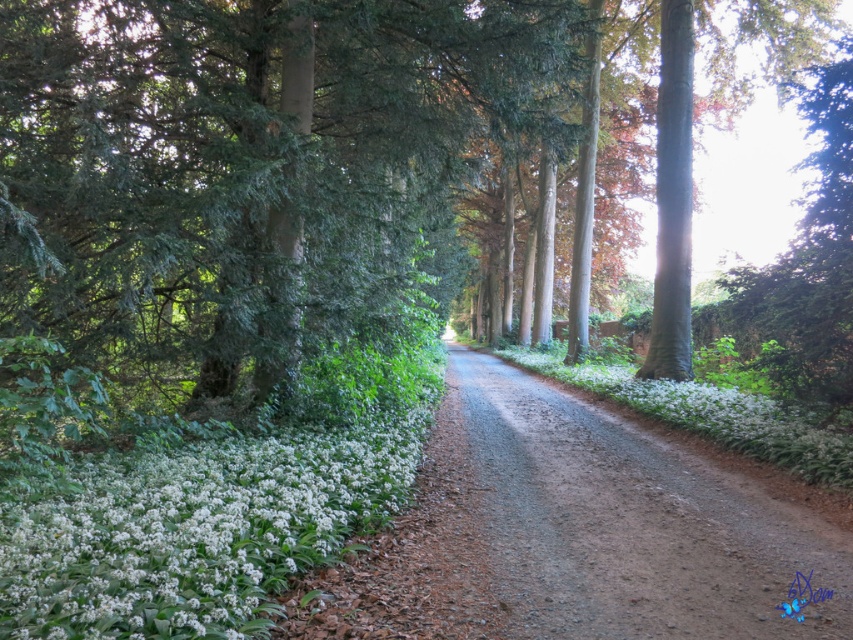
Which of these two, green textured tree at center or white matte flowers at lower left, stands shorter?

white matte flowers at lower left is shorter.

Is green textured tree at center positioned in front of white matte flowers at lower left?

That is False.

Find the location of a particular element. green textured tree at center is located at coordinates (383, 177).